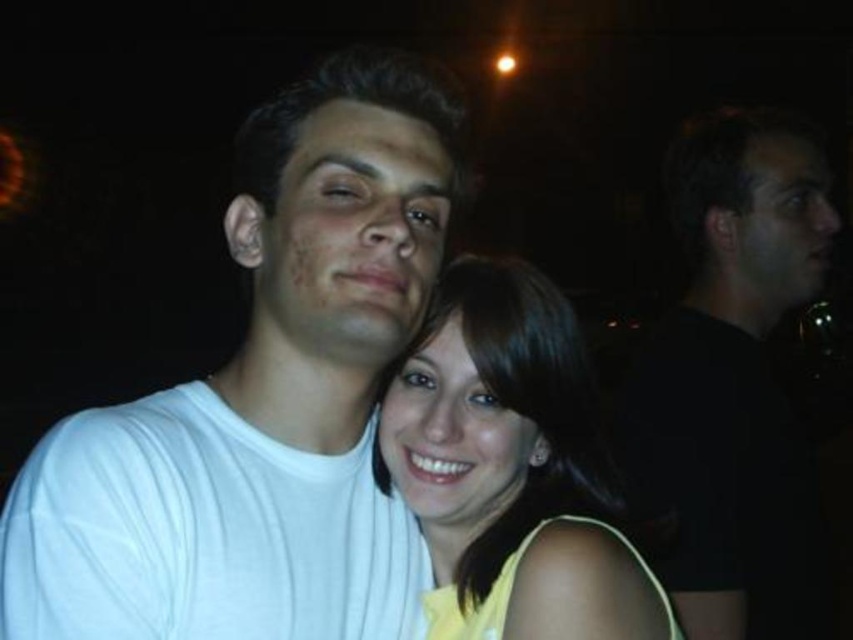
Question: Is black matte shirt at right to the right of yellow matte dress at center from the viewer's perspective?

Choices:
 (A) no
 (B) yes

Answer: (B)

Question: Based on their relative distances, which object is farther from the yellow matte dress at center?

Choices:
 (A) black matte shirt at right
 (B) white matte t-shirt at center

Answer: (A)

Question: Estimate the real-world distances between objects in this image. Which object is farther from the white matte t-shirt at center?

Choices:
 (A) yellow matte dress at center
 (B) black matte shirt at right

Answer: (B)

Question: Can you confirm if white matte t-shirt at center is positioned above yellow matte dress at center?

Choices:
 (A) yes
 (B) no

Answer: (A)

Question: Can you confirm if white matte t-shirt at center is bigger than black matte shirt at right?

Choices:
 (A) yes
 (B) no

Answer: (B)

Question: Which of the following is the closest to the observer?

Choices:
 (A) black matte shirt at right
 (B) white matte t-shirt at center

Answer: (B)